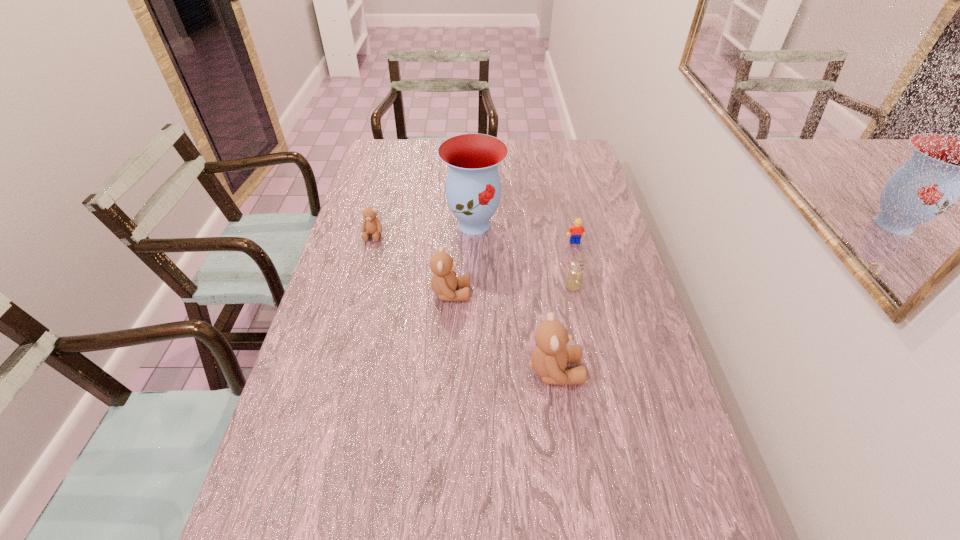
Find the location of a particular element. the leftmost teddy bear is located at coordinates (371, 225).

Where is `the leftmost object`? This screenshot has width=960, height=540. the leftmost object is located at coordinates (371, 225).

The width and height of the screenshot is (960, 540). Identify the location of the second nearest teddy bear. (444, 282).

Image resolution: width=960 pixels, height=540 pixels. In order to click on the third tallest object in this screenshot , I will do `click(444, 282)`.

At what (x,y) coordinates should I click in order to perform the action: click on the nearest teddy bear. Please return your answer as a coordinate pair (x, y). Image resolution: width=960 pixels, height=540 pixels. Looking at the image, I should click on point(549,359).

Image resolution: width=960 pixels, height=540 pixels. I want to click on the nearest object, so click(549, 359).

Find the location of a particular element. Lego is located at coordinates (577, 230).

Locate an element on the screen. The image size is (960, 540). the tallest object is located at coordinates (473, 188).

The width and height of the screenshot is (960, 540). I want to click on saltshaker, so click(x=573, y=282).

Where is `free space located 0.170m on the front-facing side of the leftmost teddy bear`? The width and height of the screenshot is (960, 540). free space located 0.170m on the front-facing side of the leftmost teddy bear is located at coordinates (361, 280).